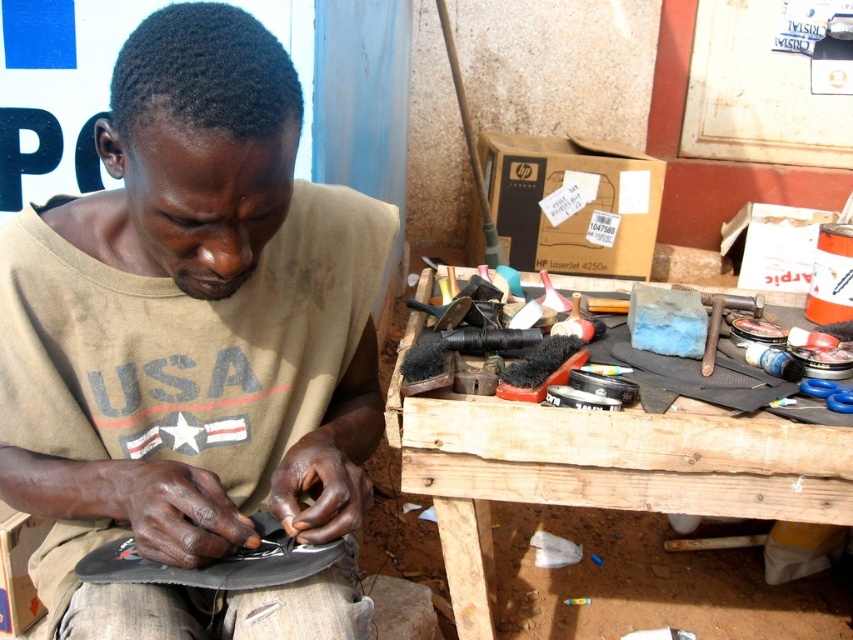
Question: Which point appears farthest from the camera in this image?

Choices:
 (A) (245, 596)
 (B) (723, 467)

Answer: (B)

Question: Which point is farther to the camera?

Choices:
 (A) (639, 435)
 (B) (206, 579)
 (C) (210, 536)

Answer: (A)

Question: Among these points, which one is farthest from the camera?

Choices:
 (A) (219, 620)
 (B) (233, 566)
 (C) (563, 452)

Answer: (C)

Question: Can you confirm if brown cotton shirt at center is positioned above wooden at center?

Choices:
 (A) no
 (B) yes

Answer: (B)

Question: Does brown cotton shirt at center lie behind wooden at center?

Choices:
 (A) yes
 (B) no

Answer: (B)

Question: Can you confirm if wooden at center is positioned below black leather shoe at lower left?

Choices:
 (A) no
 (B) yes

Answer: (A)